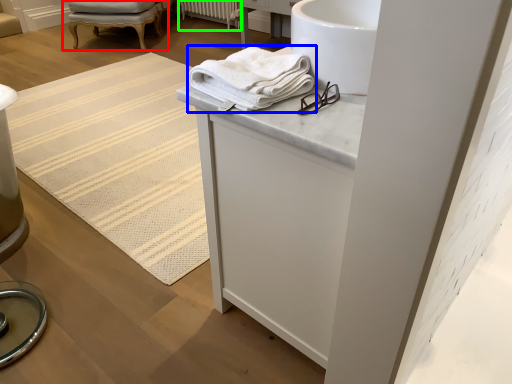
Question: Which object is the farthest from chair (highlighted by a red box)? Choose among these: towel (highlighted by a blue box) or radiator (highlighted by a green box).

Choices:
 (A) towel
 (B) radiator

Answer: (A)